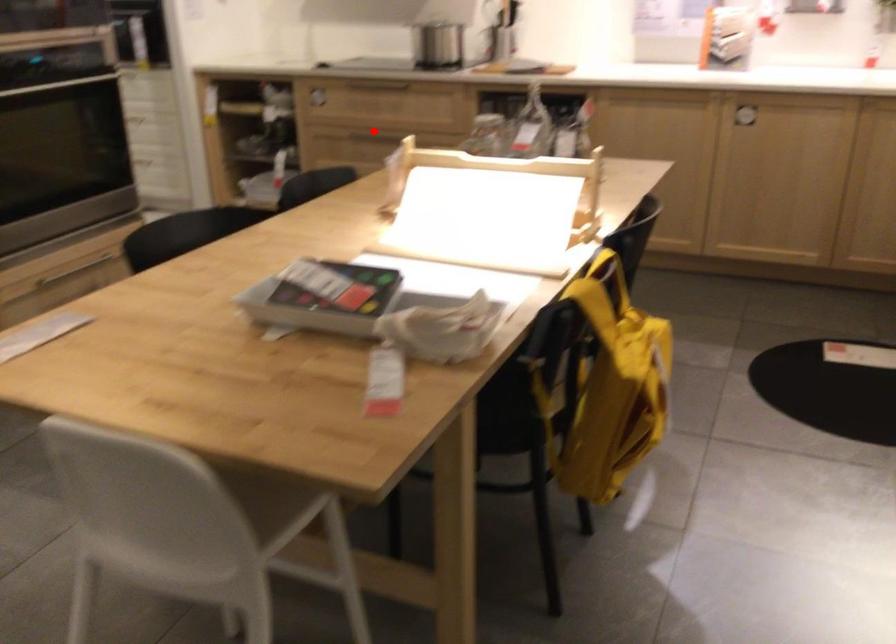
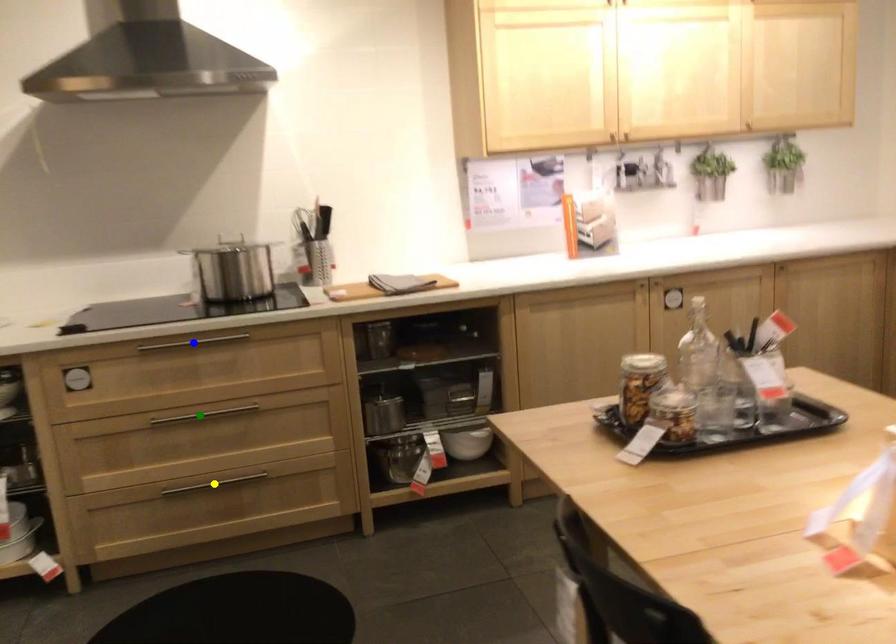
Question: I am providing you with two images of the same scene from different viewpoints. A red point is marked on the first image. You are given multiple points on the second image. Which point in image 2 is actually the same real-world point as the red point in image 1?

Choices:
 (A) yellow point
 (B) blue point
 (C) green point

Answer: (C)